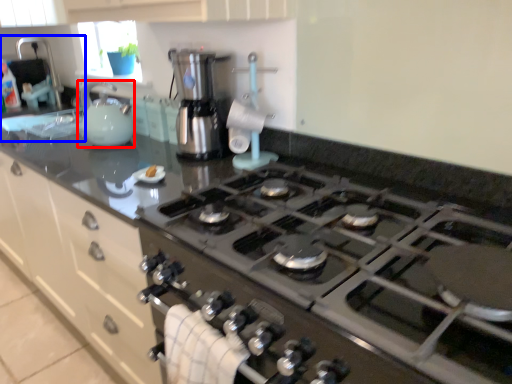
Question: Among these objects, which one is nearest to the camera, kitchen appliance (highlighted by a red box) or sink (highlighted by a blue box)?

Choices:
 (A) kitchen appliance
 (B) sink

Answer: (A)